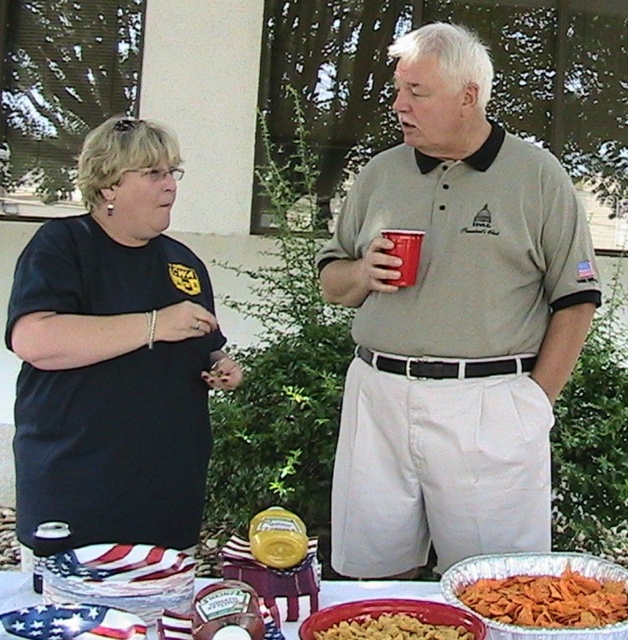
Question: Which object is the farthest from the matte plastic cup at upper center?

Choices:
 (A) yellow matte pasta at center
 (B) gray cotton shirt at center
 (C) metallic silver tray at lower center
 (D) black matte shirt at center

Answer: (A)

Question: Does gray cotton shirt at center have a smaller size compared to matte plastic cup at upper center?

Choices:
 (A) no
 (B) yes

Answer: (A)

Question: Does golden crispy chips at lower right have a greater width compared to metallic silver tray at lower center?

Choices:
 (A) yes
 (B) no

Answer: (B)

Question: Which object is positioned farthest from the metallic silver tray at lower center?

Choices:
 (A) black matte shirt at center
 (B) gray cotton shirt at center
 (C) matte plastic cup at upper center

Answer: (C)

Question: Which of the following is the farthest from the observer?

Choices:
 (A) (396, 257)
 (B) (445, 630)
 (C) (460, 294)
 (D) (460, 598)

Answer: (C)

Question: Can you confirm if gray cotton shirt at center is positioned above yellow matte pasta at center?

Choices:
 (A) no
 (B) yes

Answer: (B)